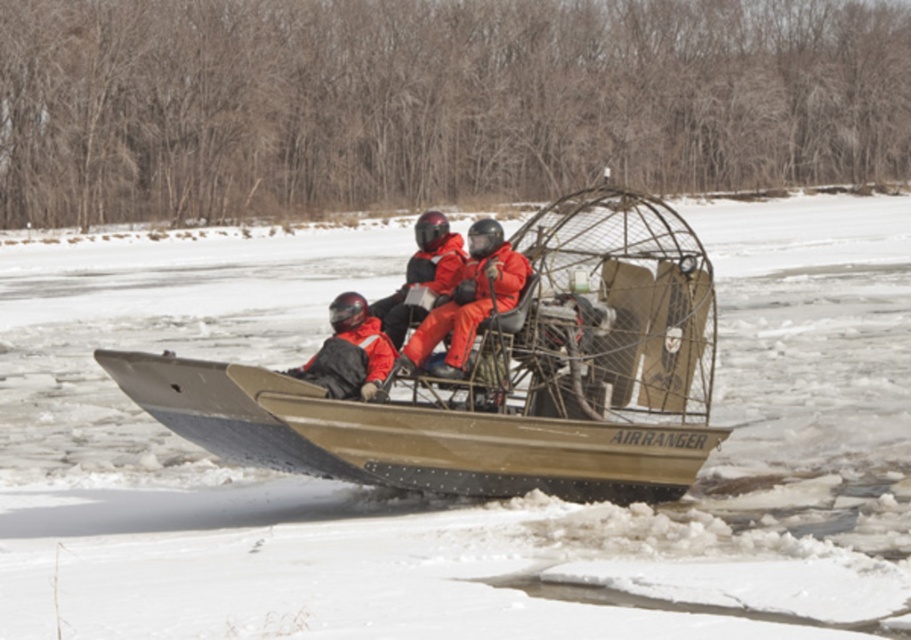
Between matte orange jacket at center and orange matte jacket at center, which one has less height?

With less height is orange matte jacket at center.

Does point (412, 342) come behind point (447, 236)?

No, it is not.

Identify the location of matte orange jacket at center. The image size is (911, 640). (468, 300).

Between brown matte snow at center and orange matte jacket at center, which one appears on the right side from the viewer's perspective?

brown matte snow at center is more to the right.

Is brown matte snow at center taller than orange matte jacket at center?

Correct, brown matte snow at center is much taller as orange matte jacket at center.

Locate an element on the screen. The height and width of the screenshot is (640, 911). brown matte snow at center is located at coordinates (459, 500).

Between matte khaki airboat at center and orange matte jacket at center, which one has less height?

orange matte jacket at center

Is matte khaki airboat at center below orange matte jacket at center?

Indeed, matte khaki airboat at center is positioned under orange matte jacket at center.

What do you see at coordinates (500, 378) in the screenshot?
I see `matte khaki airboat at center` at bounding box center [500, 378].

At what (x,y) coordinates should I click in order to perform the action: click on matte khaki airboat at center. Please return your answer as a coordinate pair (x, y). Looking at the image, I should click on (500, 378).